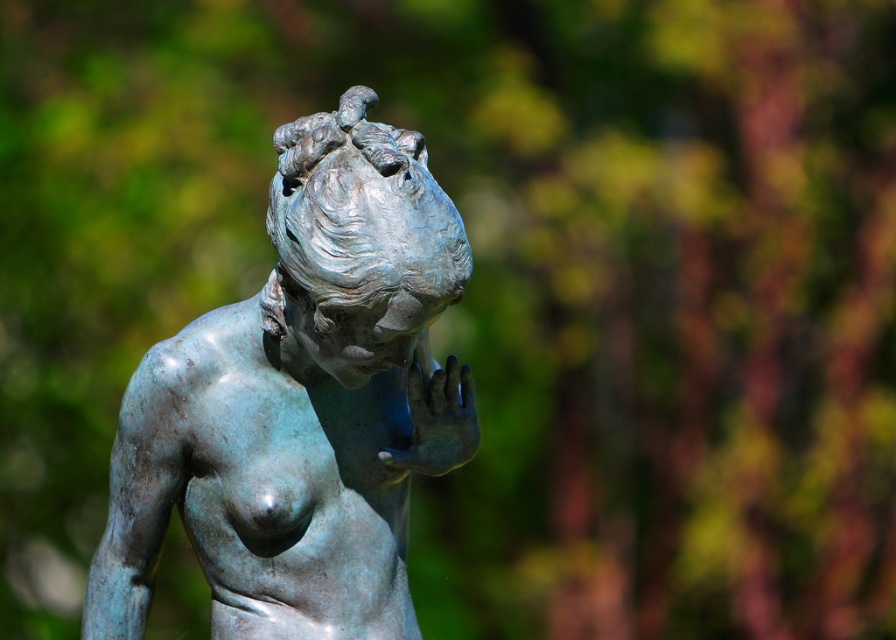
Question: Among these objects, which one is nearest to the camera?

Choices:
 (A) blue patina hand at center
 (B) blue-green patina statue at center

Answer: (B)

Question: Does blue-green patina statue at center have a greater width compared to blue patina hand at center?

Choices:
 (A) no
 (B) yes

Answer: (B)

Question: Which object appears closest to the camera in this image?

Choices:
 (A) blue patina hand at center
 (B) blue-green patina statue at center

Answer: (B)

Question: Can you confirm if blue-green patina statue at center is thinner than blue patina hand at center?

Choices:
 (A) no
 (B) yes

Answer: (A)

Question: Can you confirm if blue-green patina statue at center is wider than blue patina hand at center?

Choices:
 (A) yes
 (B) no

Answer: (A)